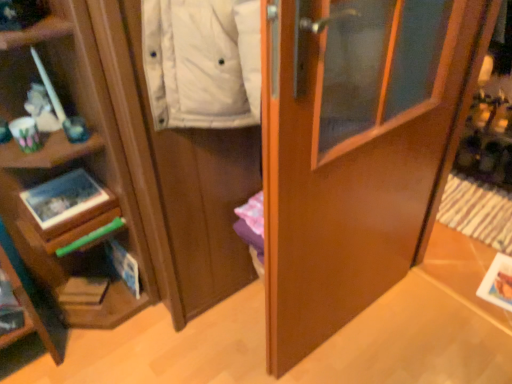
Question: From the image's perspective, is glossy wood door at center on matte wood cabinet at left?

Choices:
 (A) yes
 (B) no

Answer: (B)

Question: Is glossy wood door at center further to camera compared to matte wood cabinet at left?

Choices:
 (A) yes
 (B) no

Answer: (B)

Question: From the image's perspective, is glossy wood door at center under matte wood cabinet at left?

Choices:
 (A) no
 (B) yes

Answer: (B)

Question: Can you confirm if glossy wood door at center is taller than matte wood cabinet at left?

Choices:
 (A) no
 (B) yes

Answer: (B)

Question: Is glossy wood door at center turned away from matte wood cabinet at left?

Choices:
 (A) yes
 (B) no

Answer: (A)

Question: Considering the relative positions of glossy wood door at center and matte wood cabinet at left in the image provided, is glossy wood door at center to the left or to the right of matte wood cabinet at left?

Choices:
 (A) right
 (B) left

Answer: (A)

Question: Looking at their shapes, would you say glossy wood door at center is wider or thinner than matte wood cabinet at left?

Choices:
 (A) wide
 (B) thin

Answer: (B)

Question: Is glossy wood door at center in front of or behind matte wood cabinet at left in the image?

Choices:
 (A) front
 (B) behind

Answer: (A)

Question: Is glossy wood door at center situated inside matte wood cabinet at left or outside?

Choices:
 (A) inside
 (B) outside

Answer: (B)

Question: From their relative heights in the image, would you say matte cardboard magazine at lower left is taller or shorter than matte wood cabinet at left?

Choices:
 (A) tall
 (B) short

Answer: (B)

Question: In the image, is matte cardboard magazine at lower left positioned in front of or behind matte wood cabinet at left?

Choices:
 (A) behind
 (B) front

Answer: (A)

Question: Is point (60, 301) closer or farther from the camera than point (247, 183)?

Choices:
 (A) closer
 (B) farther

Answer: (B)

Question: From a real-world perspective, is matte cardboard magazine at lower left above or below matte wood cabinet at left?

Choices:
 (A) below
 (B) above

Answer: (A)

Question: From the image's perspective, is matte wood cabinet at left positioned above or below matte cardboard magazine at lower left?

Choices:
 (A) below
 (B) above

Answer: (B)

Question: From a real-world perspective, relative to matte cardboard magazine at lower left, is matte wood cabinet at left vertically above or below?

Choices:
 (A) below
 (B) above

Answer: (B)